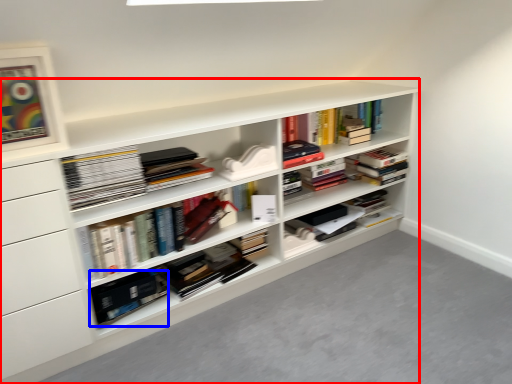
Question: Among these objects, which one is farthest to the camera, shelf (highlighted by a red box) or paperback book (highlighted by a blue box)?

Choices:
 (A) shelf
 (B) paperback book

Answer: (B)